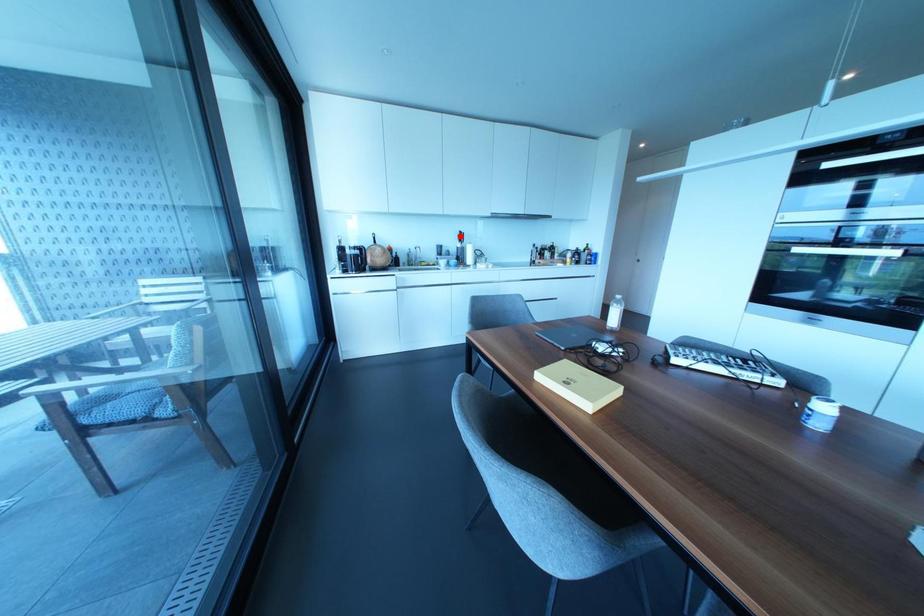
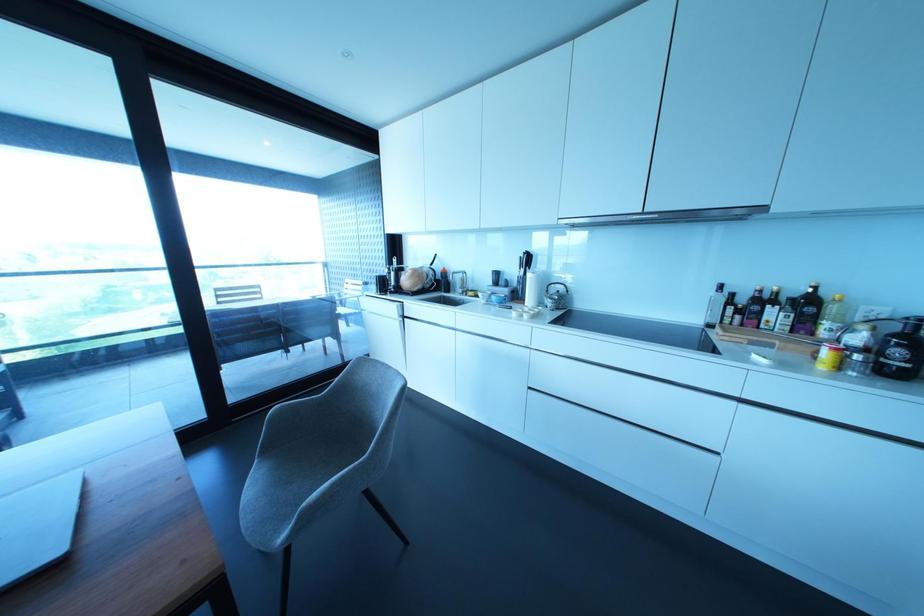
Question: I am providing you with two images of the same scene from different viewpoints. In image1, a red point is highlighted. Considering the same 3D point in image2, which of the following is correct?

Choices:
 (A) It is closer
 (B) It is farther

Answer: (B)